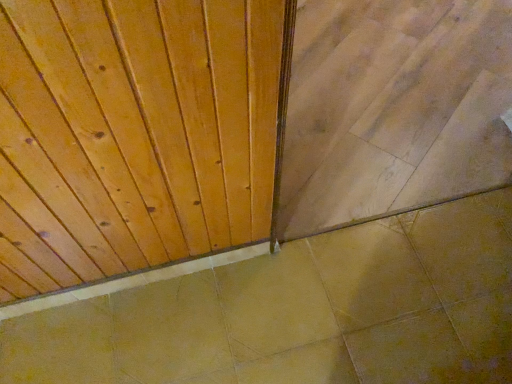
Find the location of a particular element. yellowish concrete at bottom is located at coordinates (301, 313).

What do you see at coordinates (301, 313) in the screenshot?
I see `yellowish concrete at bottom` at bounding box center [301, 313].

Locate an element on the screen. The width and height of the screenshot is (512, 384). yellowish concrete at bottom is located at coordinates (301, 313).